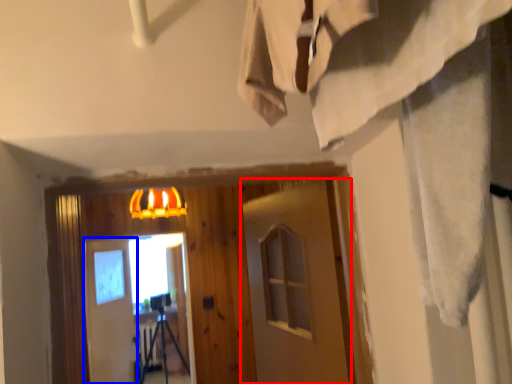
Question: Which object is closer to the camera taking this photo, barn door (highlighted by a red box) or barn door (highlighted by a blue box)?

Choices:
 (A) barn door
 (B) barn door

Answer: (A)